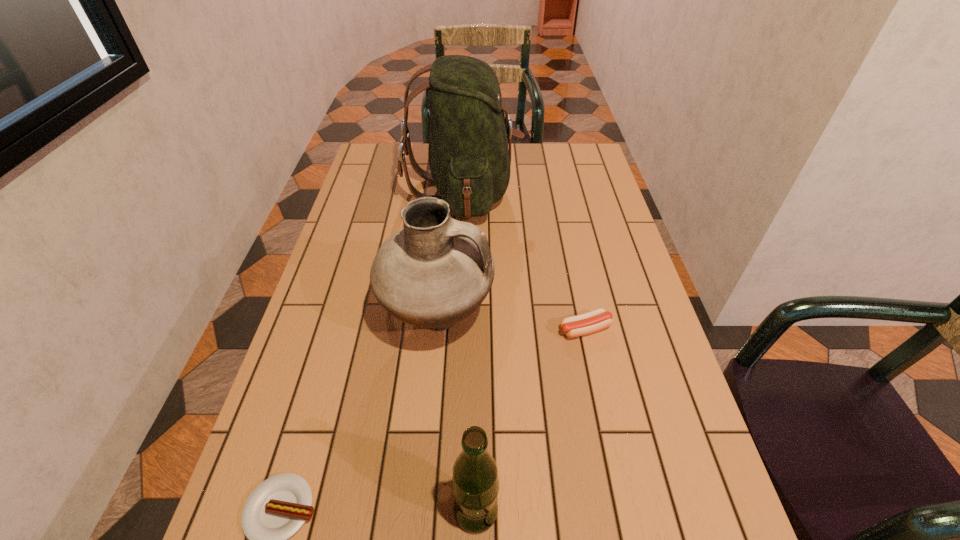
Locate an element on the screen. This screenshot has height=540, width=960. the farthest object is located at coordinates (469, 160).

The image size is (960, 540). I want to click on the tallest object, so click(469, 160).

At what (x,y) coordinates should I click in order to perform the action: click on the second tallest object. Please return your answer as a coordinate pair (x, y). Looking at the image, I should click on (436, 271).

At what (x,y) coordinates should I click in order to perform the action: click on beer bottle. Please return your answer as a coordinate pair (x, y). This screenshot has height=540, width=960. Looking at the image, I should click on (475, 484).

Locate an element on the screen. The width and height of the screenshot is (960, 540). the second shortest object is located at coordinates (596, 320).

The width and height of the screenshot is (960, 540). Find the location of `the taller sausage`. the taller sausage is located at coordinates (596, 320).

At what (x,y) coordinates should I click in order to perform the action: click on vacant space located 0.150m on the open flap of the tallest object. Please return your answer as a coordinate pair (x, y). The width and height of the screenshot is (960, 540). Looking at the image, I should click on (563, 191).

You are a GUI agent. You are given a task and a screenshot of the screen. Output one action in this format:
    pyautogui.click(x=<x>, y=<y>)
    Task: Click on the free region located 0.060m on the handle side of the second tallest object
    Image resolution: width=960 pixels, height=540 pixels.
    Given the screenshot: What is the action you would take?
    pyautogui.click(x=516, y=320)

Find the location of a particular element. The image size is (960, 540). vacant region located on the right of the third tallest object is located at coordinates (632, 511).

Find the location of a particular element. This screenshot has width=960, height=540. vacant region located on the back of the second shortest object is located at coordinates (563, 222).